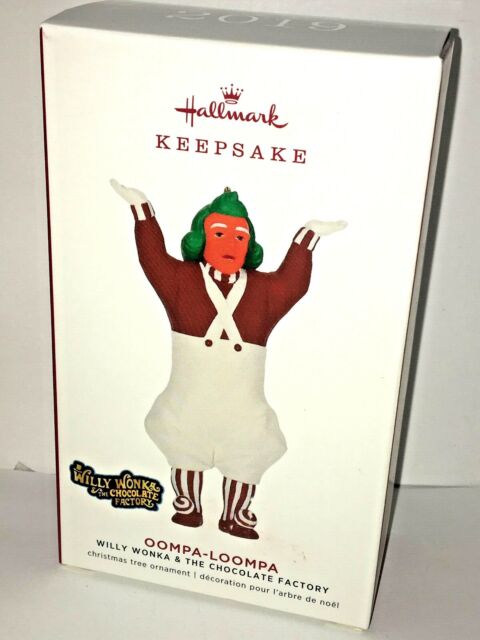
Find the location of a particular element. The width and height of the screenshot is (480, 640). surface is located at coordinates (163, 607).